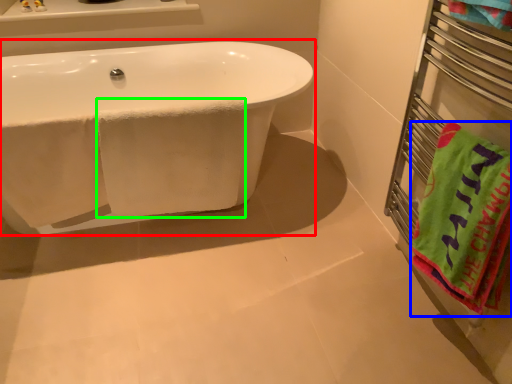
Question: Which is farther away from bathtub (highlighted by a red box)? beach towel (highlighted by a blue box) or bath towel (highlighted by a green box)?

Choices:
 (A) beach towel
 (B) bath towel

Answer: (A)